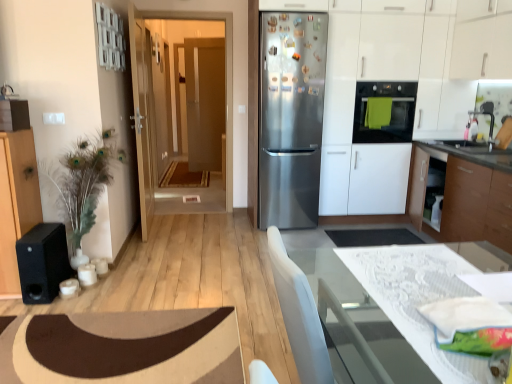
This screenshot has width=512, height=384. Find the location of `vacant region above matte black oven at center right (from a real-world perspective)`. vacant region above matte black oven at center right (from a real-world perspective) is located at coordinates (385, 76).